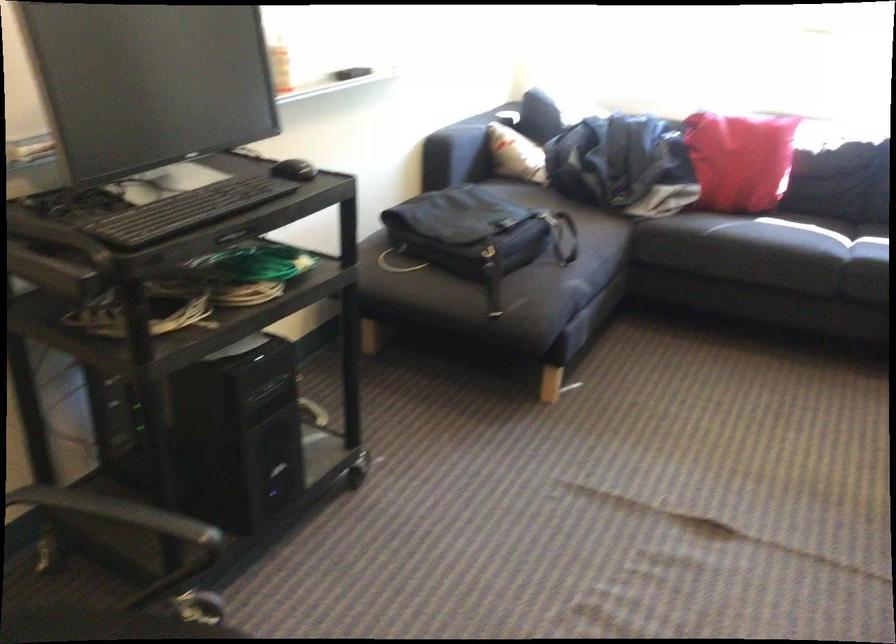
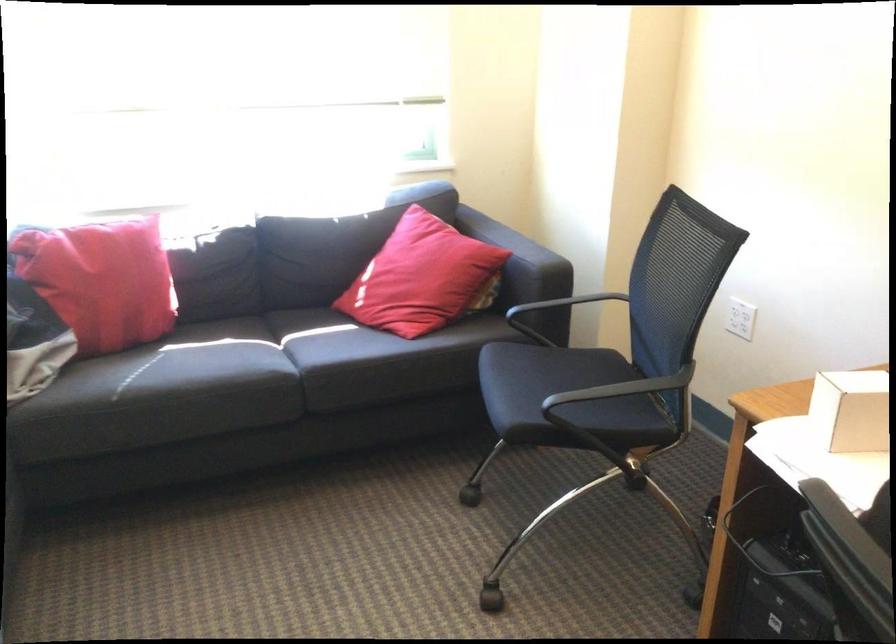
Question: The images are taken continuously from a first-person perspective. In which direction is your viewpoint rotating?

Choices:
 (A) Left
 (B) Right
 (C) Up
 (D) Down

Answer: (B)